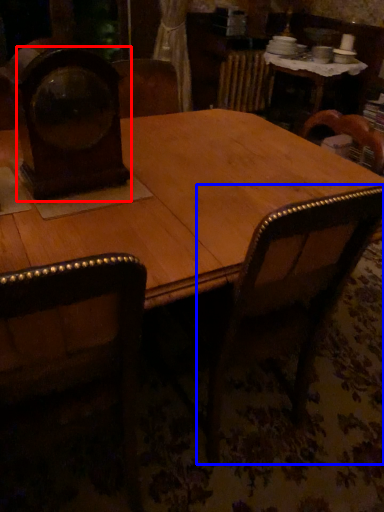
Question: Which object is closer to the camera taking this photo, clock (highlighted by a red box) or armchair (highlighted by a blue box)?

Choices:
 (A) clock
 (B) armchair

Answer: (B)